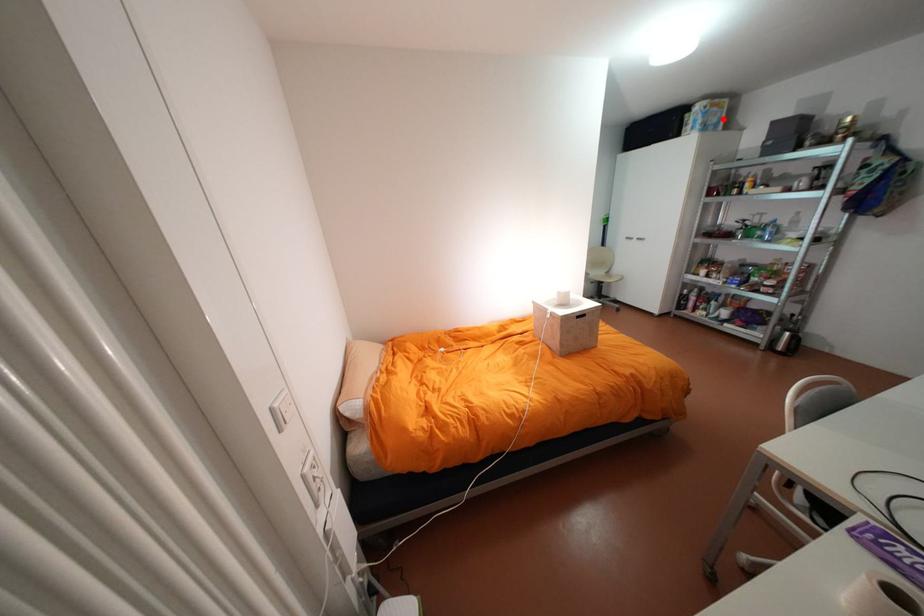
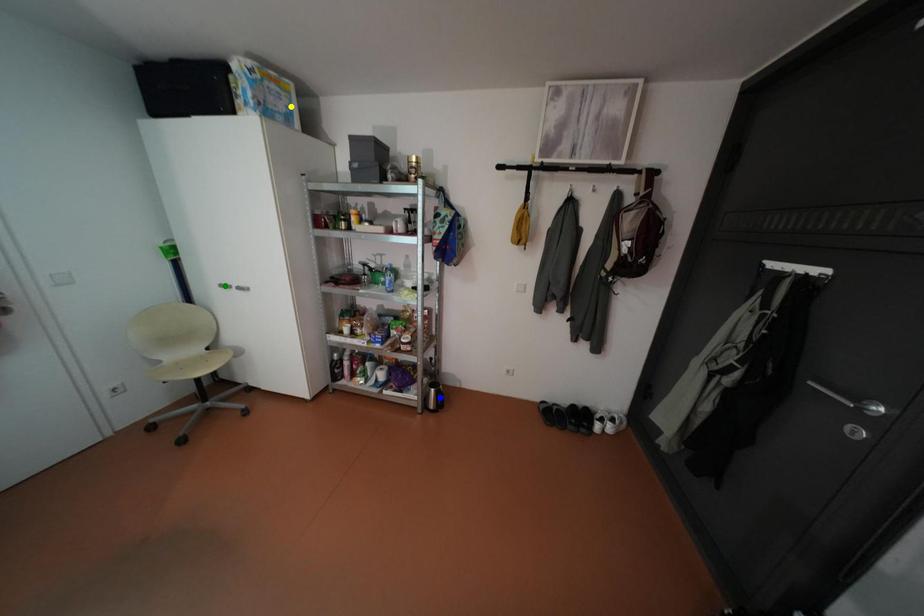
Question: I am providing you with two images of the same scene from different viewpoints. A red point is marked on the first image. You are given multiple points on the second image. Which spot in image 2 lines up with the point in image 1?

Choices:
 (A) blue point
 (B) yellow point
 (C) green point

Answer: (B)